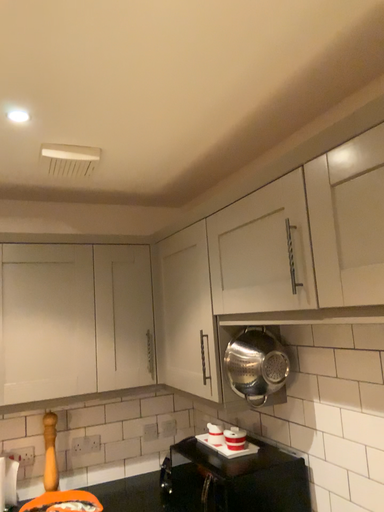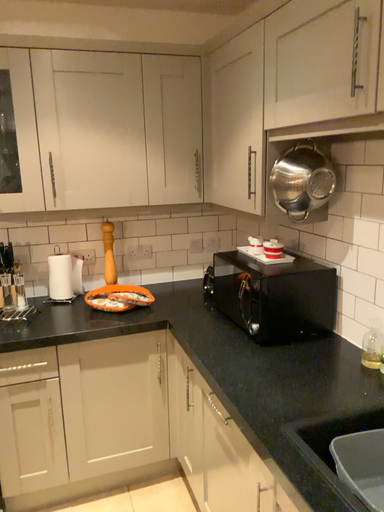
Question: Which way did the camera rotate in the video?

Choices:
 (A) rotated right
 (B) rotated left

Answer: (B)